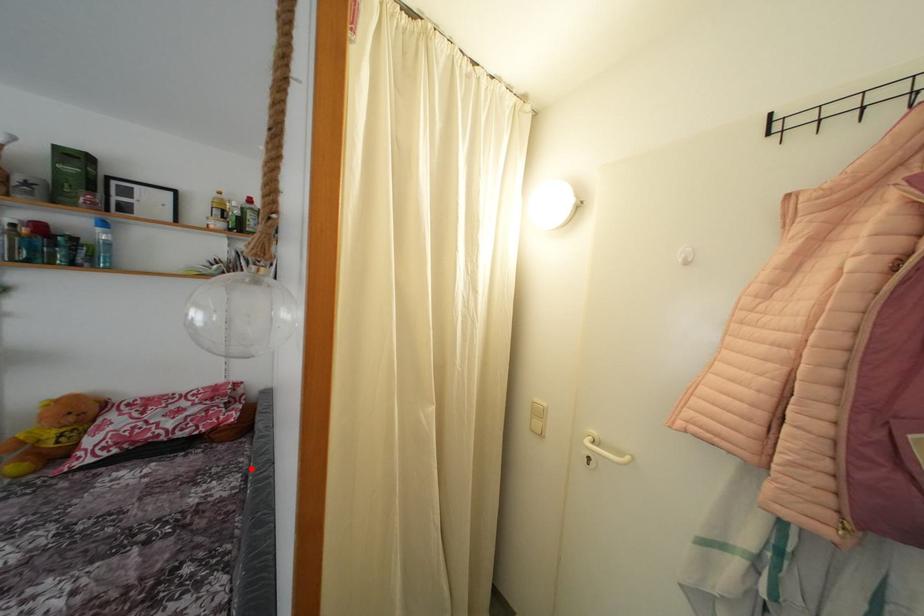
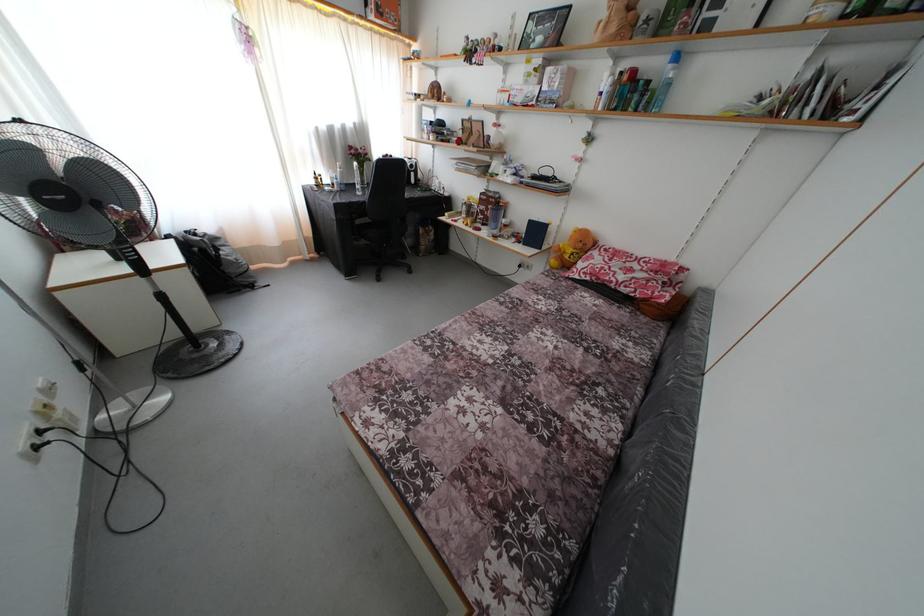
Question: I am providing you with two images of the same scene from different viewpoints. Given a red point in image1, look at the same physical point in image2. Is it:

Choices:
 (A) Closer to the viewpoint
 (B) Farther from the viewpoint

Answer: (A)